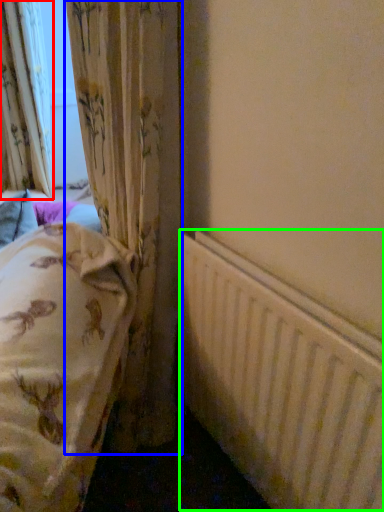
Question: Which object is the farthest from curtain (highlighted by a red box)? Choose among these: curtain (highlighted by a blue box) or radiator (highlighted by a green box).

Choices:
 (A) curtain
 (B) radiator

Answer: (B)